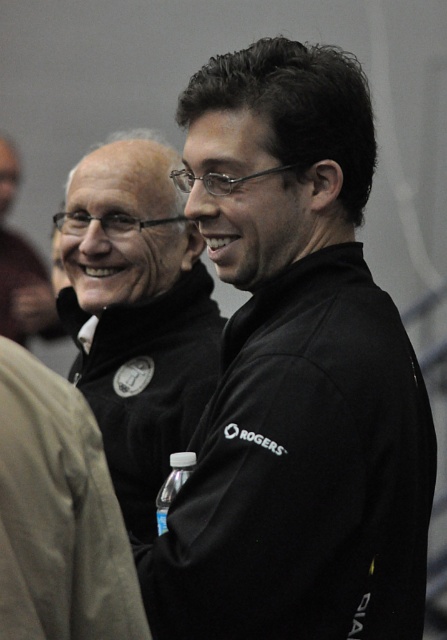
You are a photographer standing at the center of the scene. You want to take a photo that includes both the black fleece sweatshirt at center and the matte black jacket at upper left. Given that your camera has a maximum focus range of 3 meters, will you be able to capture both objects in focus without adjusting your position?

The distance between the black fleece sweatshirt at center and the matte black jacket at upper left is 3.76 meters. Since the camera can only focus up to 3 meters, it will not be able to keep both objects in focus simultaneously without moving closer or adjusting the focus settings.

You are organizing a charity event and need to decide which jacket to display in the front. The black matte jacket at center and the black fleece sweatshirt at center are both candidates. Based on their sizes, which one should be placed in the front to make it more prominent?

The black matte jacket at center is taller than the black fleece sweatshirt at center, so placing the black matte jacket at center in the front will make it more prominent due to its greater height.